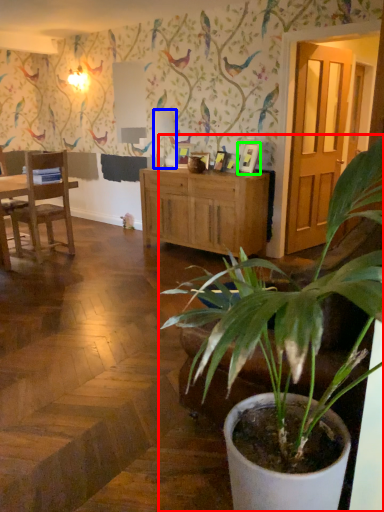
Question: Estimate the real-world distances between objects in this image. Which object is closer to houseplant (highlighted by a red box), lamp (highlighted by a blue box) or picture frame (highlighted by a green box)?

Choices:
 (A) lamp
 (B) picture frame

Answer: (B)